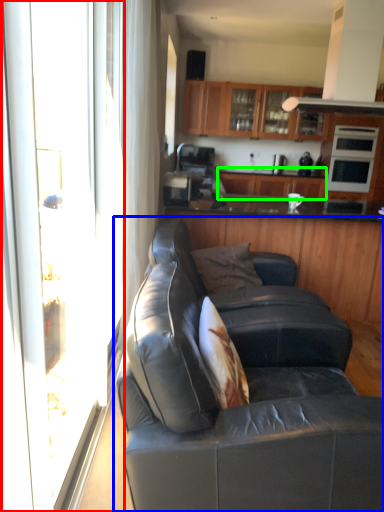
Question: Based on their relative distances, which object is nearer to screen door (highlighted by a red box)? Choose from studio couch (highlighted by a blue box) and cabinetry (highlighted by a green box).

Choices:
 (A) studio couch
 (B) cabinetry

Answer: (A)